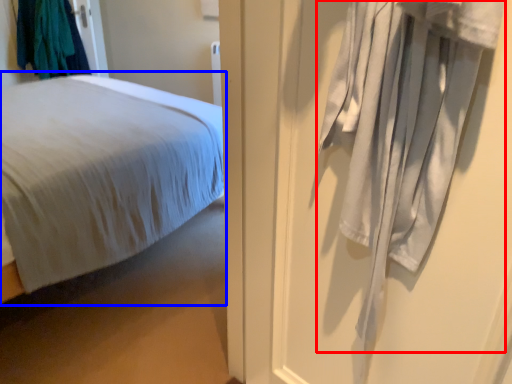
Question: Which of the following is the farthest to the observer, curtain (highlighted by a red box) or bed (highlighted by a blue box)?

Choices:
 (A) curtain
 (B) bed

Answer: (B)